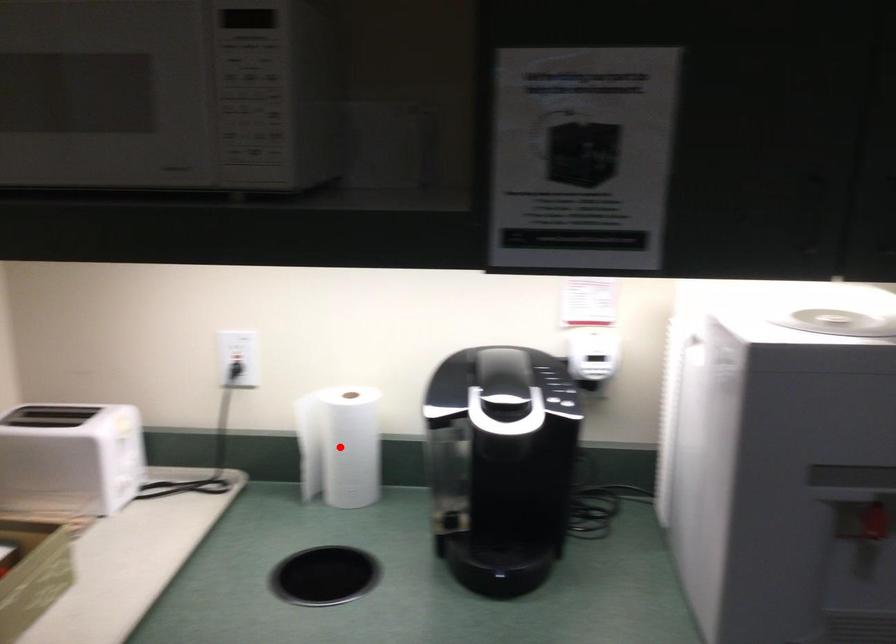
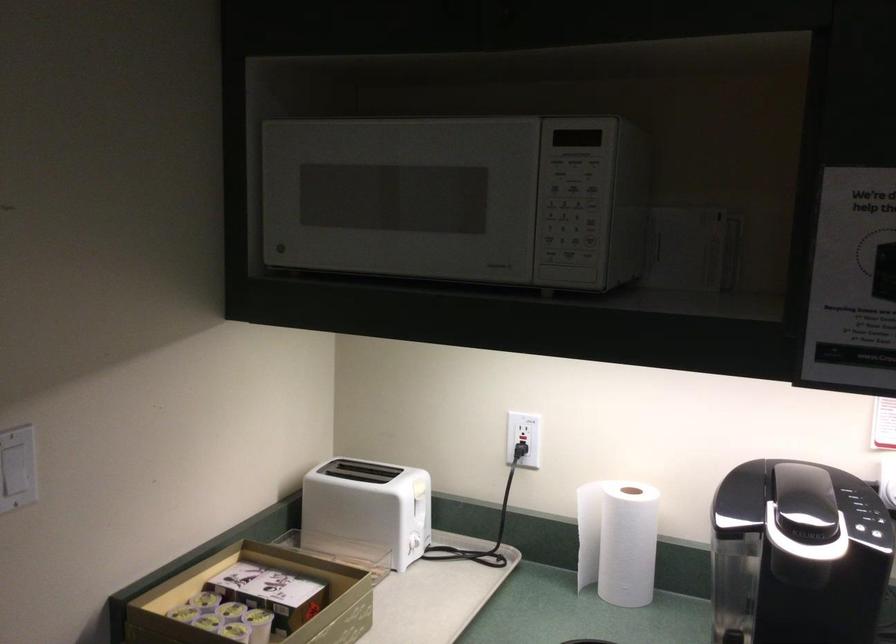
Question: I am providing you with two images of the same scene from different viewpoints. A red point is marked on the first image. At the location where the point appears in image 1, is it still visible in image 2?

Choices:
 (A) Yes
 (B) No

Answer: (A)